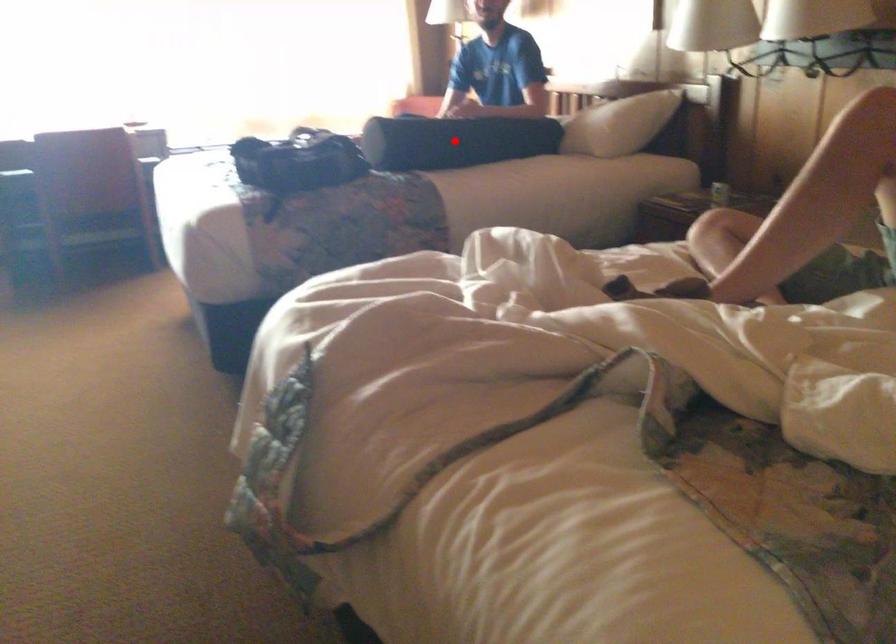
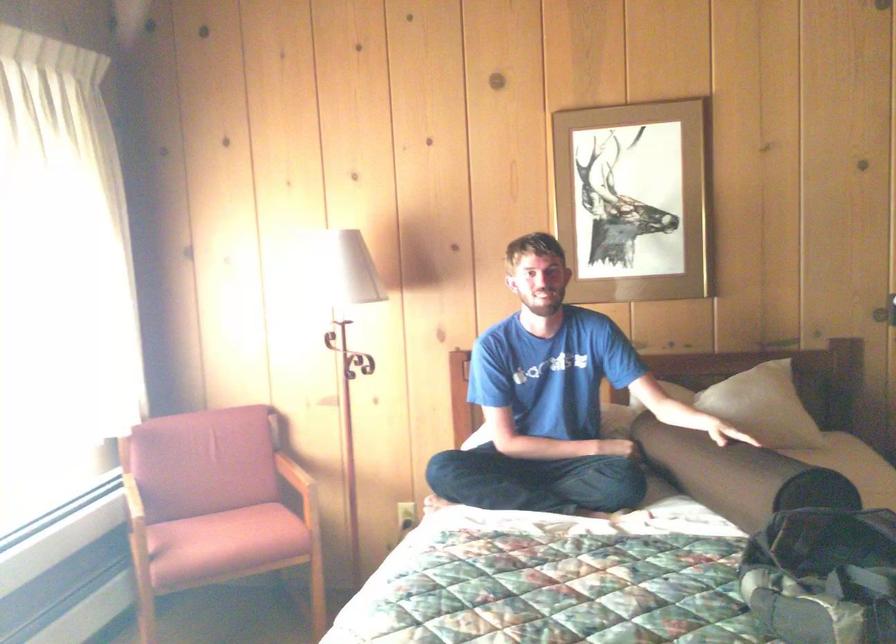
Question: I am providing you with two images of the same scene from different viewpoints. A red point is marked on the first image. Can you still see the location of the red point in image 2?

Choices:
 (A) Yes
 (B) No

Answer: (B)